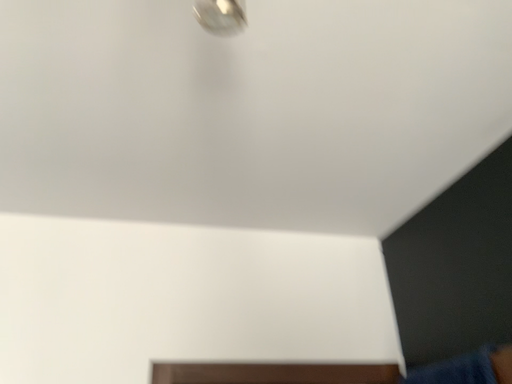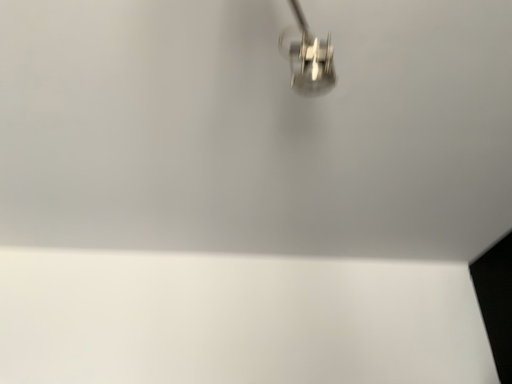
Question: Which way did the camera rotate in the video?

Choices:
 (A) rotated left
 (B) rotated right

Answer: (A)